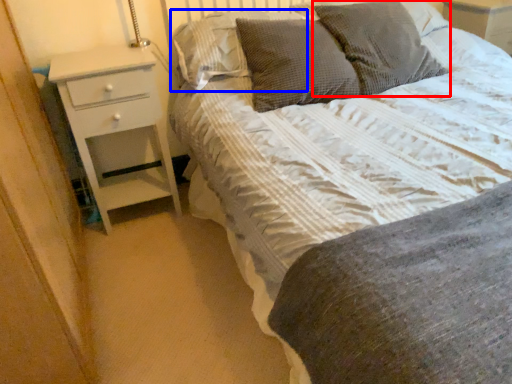
Question: Which of the following is the closest to the observer, pillow (highlighted by a red box) or pillow (highlighted by a blue box)?

Choices:
 (A) pillow
 (B) pillow

Answer: (A)